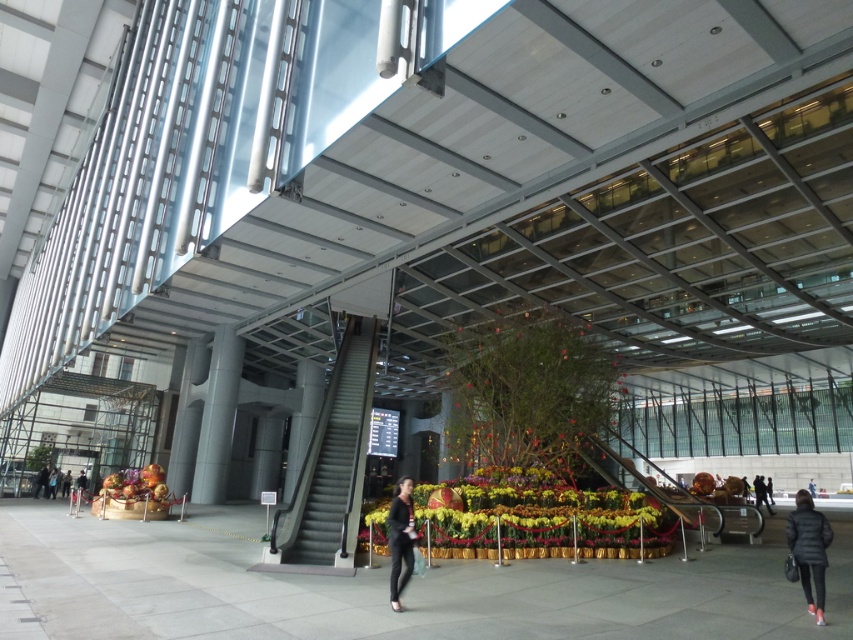
You are a security guard standing at the entrance of the building. You need to ensure that the yellow floral arrangement at center and the black matte pants at center are visible to the surveillance camera mounted above. Based on their heights, which object might be partially blocked from the camera view?

The yellow floral arrangement at center is much taller than the black matte pants at center, so the camera might have a better view of the black matte pants at center while the taller yellow floral arrangement at center could block part of the view.

You are standing at the entrance of the building and want to walk towards the point labeled as point (65, 490). However, there is an obstacle at point (567, 497). Will you be able to reach your destination without going around the obstacle?

Since point (567, 497) is in front of point (65, 490), the obstacle at point (567, 497) is blocking the path to your destination. Therefore, you will need to go around the obstacle to reach point (65, 490).

You are a decorator who needs to place a new rectangular table in the center of the space. The table is 1.2 meters wide. Considering the yellow floral arrangement at center and the black matte pants at center, which object will the table overlap with when placed centrally?

The yellow floral arrangement at center has a larger width than the black matte pants at center. Since the table is 1.2 meters wide and placed centrally, it will overlap with the yellow floral arrangement at center due to its greater width.